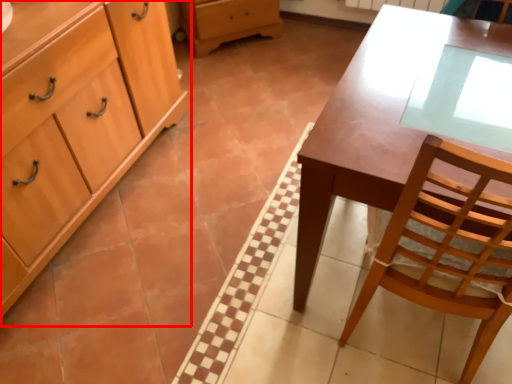
Question: From the image's perspective, where is cabinetry (annotated by the red box) located in relation to desk in the image?

Choices:
 (A) below
 (B) above

Answer: (B)